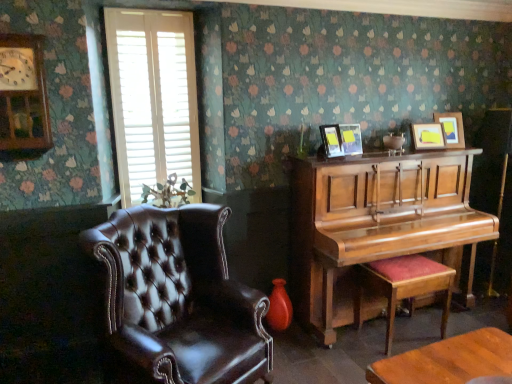
Locate an element on the screen. This screenshot has width=512, height=384. empty space that is ontop of wooden clock at upper left (from a real-world perspective) is located at coordinates (15, 35).